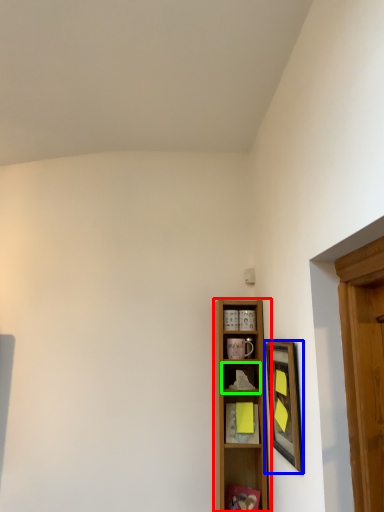
Question: Which object is the closest to the shelf (highlighted by a red box)? Choose among these: picture frame (highlighted by a blue box) or shelf (highlighted by a green box).

Choices:
 (A) picture frame
 (B) shelf

Answer: (B)